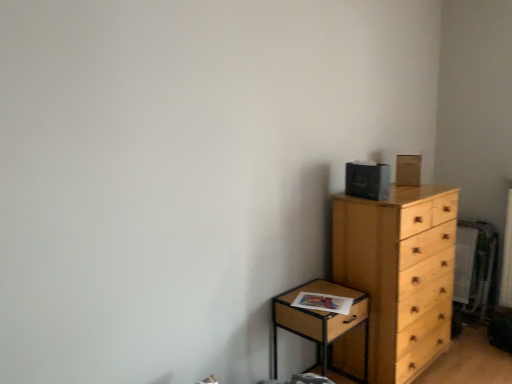
Question: From the image's perspective, is wooden nightstand at lower right below light wood chest of drawers at right?

Choices:
 (A) no
 (B) yes

Answer: (B)

Question: Is light wood chest of drawers at right at the back of wooden nightstand at lower right?

Choices:
 (A) no
 (B) yes

Answer: (A)

Question: Does wooden nightstand at lower right have a lesser height compared to light wood chest of drawers at right?

Choices:
 (A) yes
 (B) no

Answer: (A)

Question: Does wooden nightstand at lower right have a greater height compared to light wood chest of drawers at right?

Choices:
 (A) yes
 (B) no

Answer: (B)

Question: Is wooden nightstand at lower right with light wood chest of drawers at right?

Choices:
 (A) no
 (B) yes

Answer: (A)

Question: From a real-world perspective, is wooden nightstand at lower right beneath light wood chest of drawers at right?

Choices:
 (A) yes
 (B) no

Answer: (A)

Question: Is light wood chest of drawers at right at the right side of wooden nightstand at lower right?

Choices:
 (A) no
 (B) yes

Answer: (B)

Question: Is light wood chest of drawers at right positioned before wooden nightstand at lower right?

Choices:
 (A) yes
 (B) no

Answer: (B)

Question: From the image's perspective, would you say light wood chest of drawers at right is positioned over wooden nightstand at lower right?

Choices:
 (A) no
 (B) yes

Answer: (B)

Question: From the image's perspective, does light wood chest of drawers at right appear lower than wooden nightstand at lower right?

Choices:
 (A) yes
 (B) no

Answer: (B)

Question: Can you confirm if light wood chest of drawers at right is smaller than wooden nightstand at lower right?

Choices:
 (A) no
 (B) yes

Answer: (A)

Question: Can you confirm if light wood chest of drawers at right is bigger than wooden nightstand at lower right?

Choices:
 (A) yes
 (B) no

Answer: (A)

Question: Do you think light wood chest of drawers at right is within wooden nightstand at lower right, or outside of it?

Choices:
 (A) inside
 (B) outside

Answer: (B)